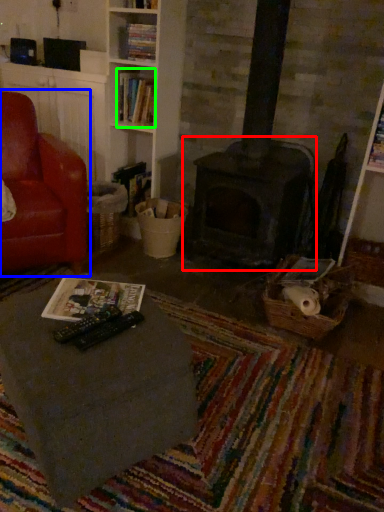
Question: Which is nearer to the fireplace (highlighted by a red box)? chair (highlighted by a blue box) or book (highlighted by a green box).

Choices:
 (A) chair
 (B) book

Answer: (B)